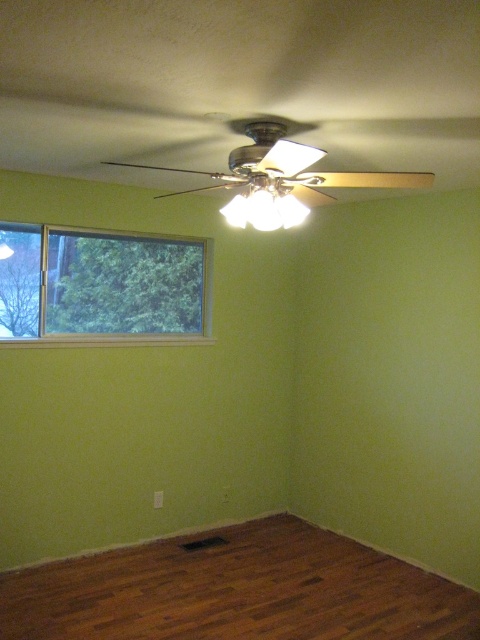
You are standing in the room and want to place a tall houseplant that is 1.2 meters in height. Given the brown wood floor at lower center and the clear glass window at left, which object would you consider in terms of height to ensure the plant can be placed safely without blocking the window?

The brown wood floor at lower center is not as tall as the clear glass window at left. Since the plant is 1.2 meters tall, you should ensure it doesn not exceed the floor height. However, since the floor is lower than the window, placing the plant on the floor won not block the window as long as it is positioned away from the window area.

You are standing in the center of the room and see two points marked on the floor. The first point is at position point (283, 545) and the second is at point (193, 237). If you want to walk towards the point that is closer to the window, which point should you go to?

Point (283, 545) is in front of point (193, 237), so the point closer to the window is point (283, 545).